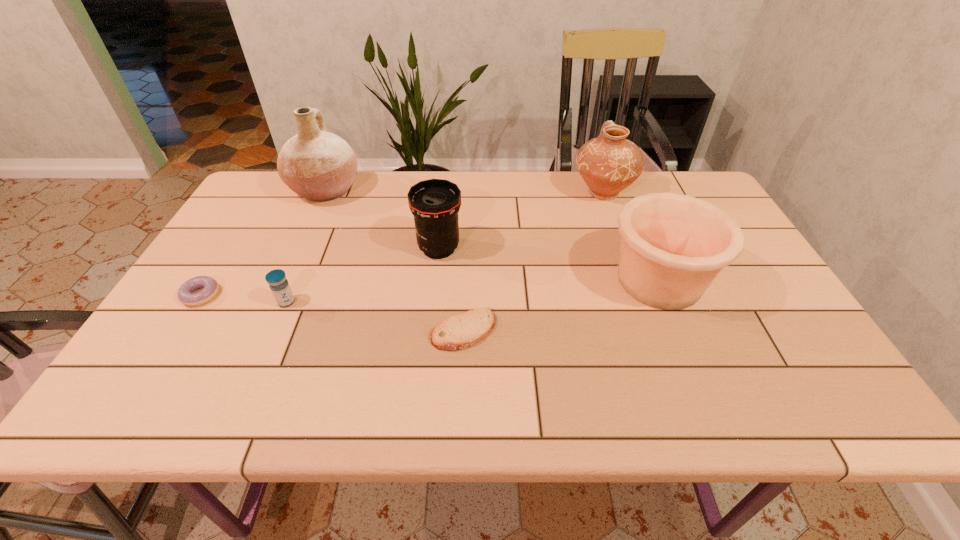
Where is `free spot located 0.400m on the left of the shortest pottery`? This screenshot has width=960, height=540. free spot located 0.400m on the left of the shortest pottery is located at coordinates (448, 281).

Image resolution: width=960 pixels, height=540 pixels. In order to click on free location located 0.160m on the back of the medicine in this screenshot , I will do [x=307, y=253].

Find the location of a particular element. The height and width of the screenshot is (540, 960). blank space located 0.070m on the right of the doughnut is located at coordinates (248, 295).

Where is `free location located 0.310m on the left of the shortest object`? The image size is (960, 540). free location located 0.310m on the left of the shortest object is located at coordinates (296, 330).

Find the location of `pottery present at the left edge`. pottery present at the left edge is located at coordinates (320, 166).

This screenshot has width=960, height=540. In order to click on doughnut located in the left edge section of the desktop in this screenshot , I will do `click(185, 294)`.

At what (x,y) coordinates should I click in order to perform the action: click on object that is at the right edge. Please return your answer as a coordinate pair (x, y). This screenshot has width=960, height=540. Looking at the image, I should click on (673, 246).

Locate an element on the screen. object that is positioned at the far left corner is located at coordinates (320, 166).

You are a GUI agent. You are given a task and a screenshot of the screen. Output one action in this format:
    pyautogui.click(x=<x>, y=<y>)
    Task: Click on the vacant space at the far edge
    
    Given the screenshot: What is the action you would take?
    pyautogui.click(x=466, y=212)

The image size is (960, 540). I want to click on vacant space at the near edge of the desktop, so click(488, 403).